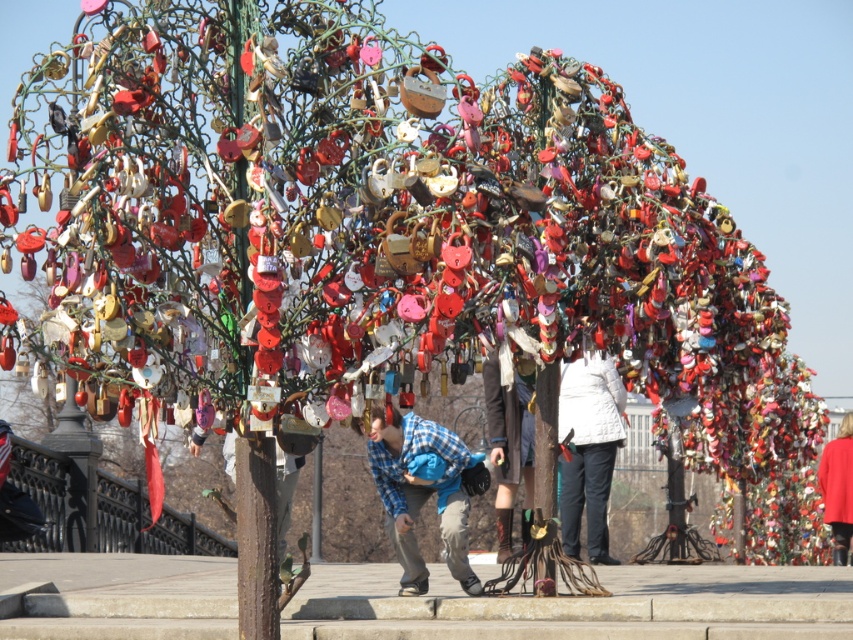
Question: Which object appears closest to the camera in this image?

Choices:
 (A) knitted sweater at center
 (B) white matte jacket at center

Answer: (A)

Question: Considering the real-world distances, which object is farthest from the white matte jacket at center?

Choices:
 (A) blue plaid shirt at center
 (B) red fabric coat at lower right
 (C) knitted sweater at center

Answer: (B)

Question: Among these objects, which one is farthest from the camera?

Choices:
 (A) knitted sweater at center
 (B) white matte jacket at center
 (C) blue plaid shirt at center
 (D) red fabric coat at lower right

Answer: (D)

Question: Observing the image, what is the correct spatial positioning of knitted sweater at center in reference to white matte jacket at center?

Choices:
 (A) left
 (B) right

Answer: (A)

Question: Does blue plaid shirt at center have a greater width compared to knitted sweater at center?

Choices:
 (A) yes
 (B) no

Answer: (B)

Question: Can you confirm if blue plaid shirt at center is bigger than knitted sweater at center?

Choices:
 (A) yes
 (B) no

Answer: (B)